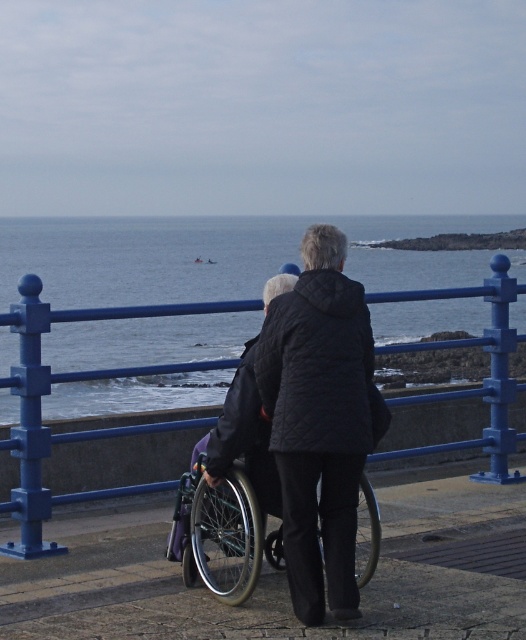
Between black quilted jacket at center and silver metallic wheelchair at center, which one has more height?

black quilted jacket at center

Does black quilted jacket at center have a greater height compared to silver metallic wheelchair at center?

Correct, black quilted jacket at center is much taller as silver metallic wheelchair at center.

Is point (317, 474) positioned behind point (240, 598)?

No, it is not.

Locate an element on the screen. Image resolution: width=526 pixels, height=640 pixels. black quilted jacket at center is located at coordinates (311, 420).

Between blue water at center and black quilted jacket at center, which one has less height?

Standing shorter between the two is black quilted jacket at center.

Is blue water at center to the left of black quilted jacket at center from the viewer's perspective?

Yes, blue water at center is to the left of black quilted jacket at center.

Between point (439, 278) and point (301, 618), which one is positioned behind?

Positioned behind is point (439, 278).

Find the location of a particular element. blue water at center is located at coordinates (222, 256).

Is blue water at center taller than silver metallic wheelchair at center?

Yes, blue water at center is taller than silver metallic wheelchair at center.

At what (x,y) coordinates should I click in order to perform the action: click on blue water at center. Please return your answer as a coordinate pair (x, y). The image size is (526, 640). Looking at the image, I should click on (222, 256).

What do you see at coordinates (222, 256) in the screenshot?
I see `blue water at center` at bounding box center [222, 256].

The width and height of the screenshot is (526, 640). Identify the location of blue water at center. (222, 256).